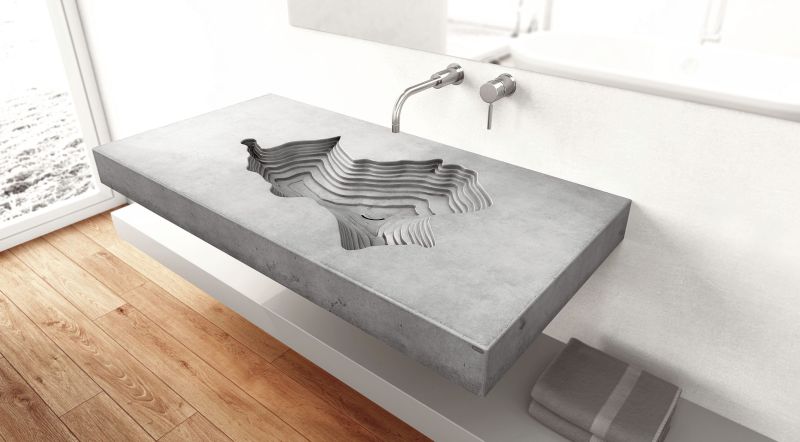
Where is `the bottom  grey towel`? the bottom  grey towel is located at coordinates (560, 429).